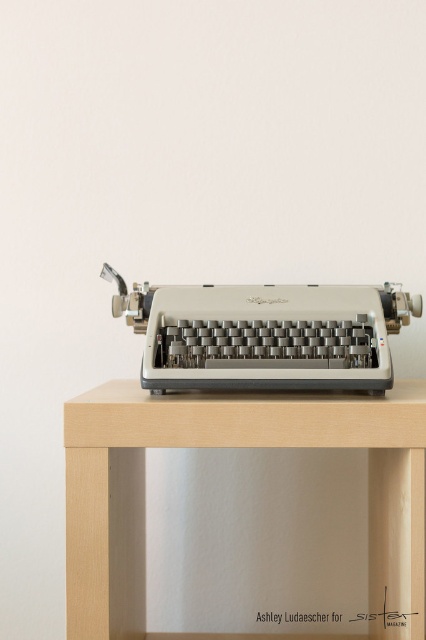
Question: Among these points, which one is nearest to the camera?

Choices:
 (A) (138, 560)
 (B) (383, 355)

Answer: (B)

Question: Can you confirm if light wood table at center is positioned above matte silver typewriter at center?

Choices:
 (A) no
 (B) yes

Answer: (A)

Question: Can you confirm if light wood table at center is bigger than matte silver typewriter at center?

Choices:
 (A) yes
 (B) no

Answer: (A)

Question: Which of the following is the closest to the observer?

Choices:
 (A) light wood table at center
 (B) matte silver typewriter at center

Answer: (A)

Question: Is light wood table at center wider than matte silver typewriter at center?

Choices:
 (A) no
 (B) yes

Answer: (B)

Question: Which of the following is the farthest from the observer?

Choices:
 (A) matte silver typewriter at center
 (B) light wood table at center

Answer: (A)